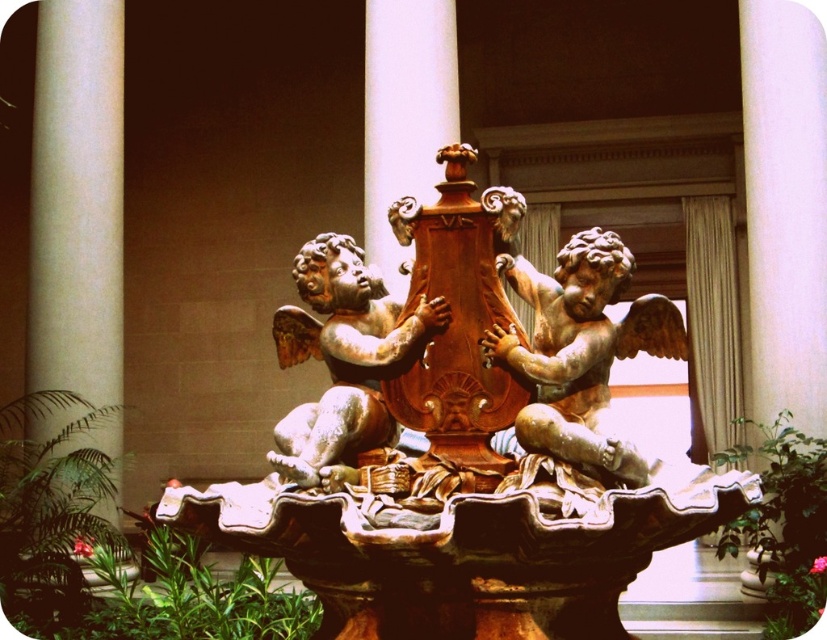
You are standing in front of the fountain and want to take a photo of the white smooth pillar at left and the matte bronze cherub fountain at center. Which object should you position to your left side in the camera frame?

The white smooth pillar at left should be positioned to your left side in the camera frame because the matte bronze cherub fountain at center is to the right of the white smooth pillar at left.